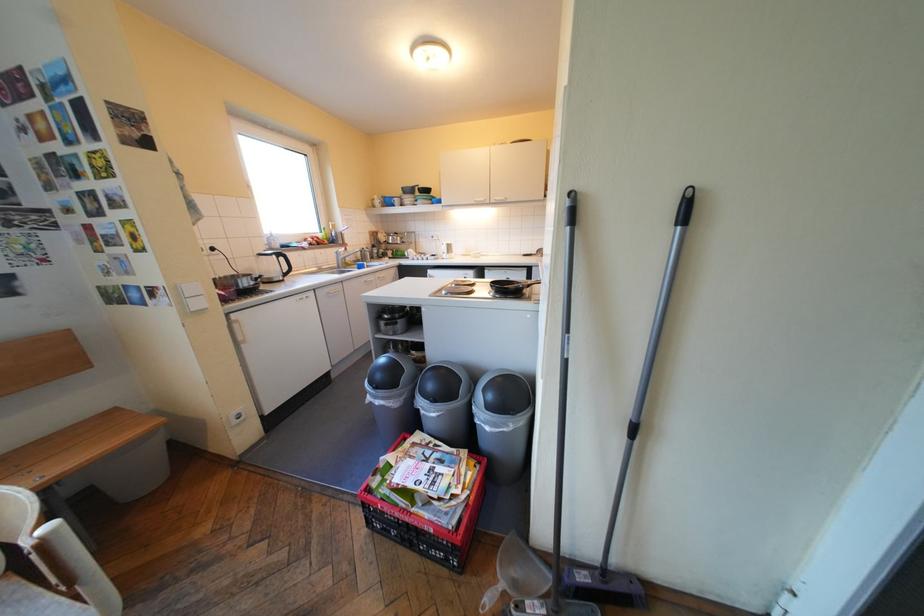
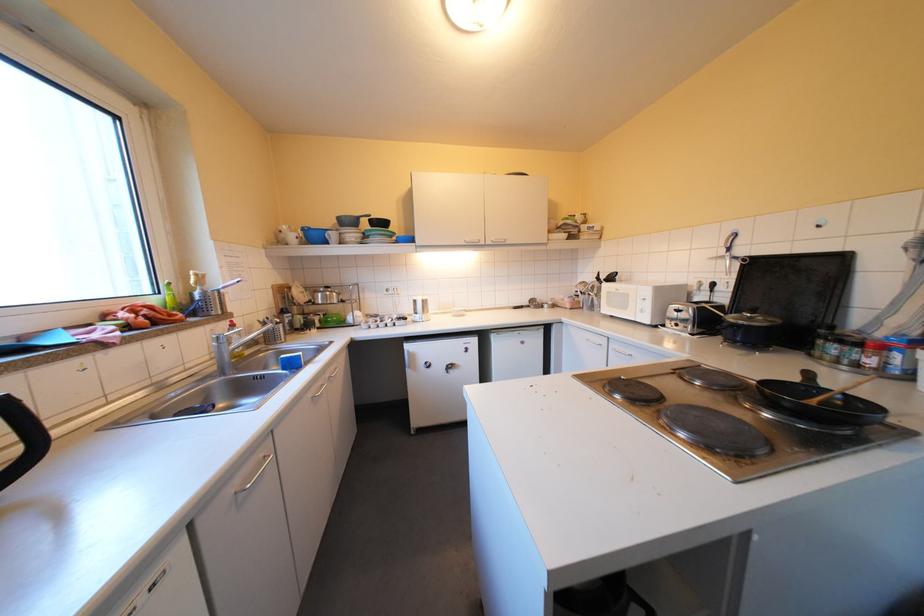
Find the pixel in the second image that matches point 417,256 in the first image.

(356, 323)